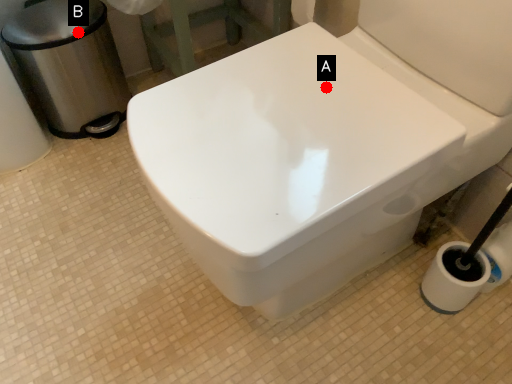
Question: Two points are circled on the image, labeled by A and B beside each circle. Which of the following is the farthest from the observer?

Choices:
 (A) A is further
 (B) B is further

Answer: (B)